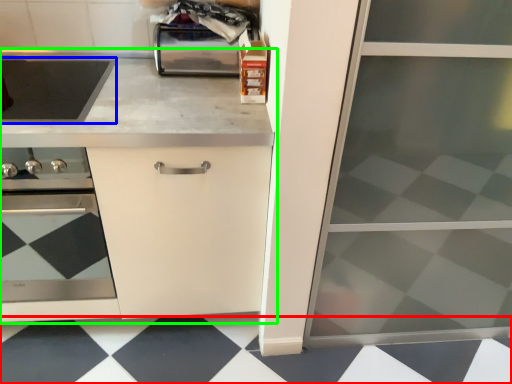
Question: Estimate the real-world distances between objects in this image. Which object is farther from tile (highlighted by a red box), kitchen appliance (highlighted by a blue box) or countertop (highlighted by a green box)?

Choices:
 (A) kitchen appliance
 (B) countertop

Answer: (A)